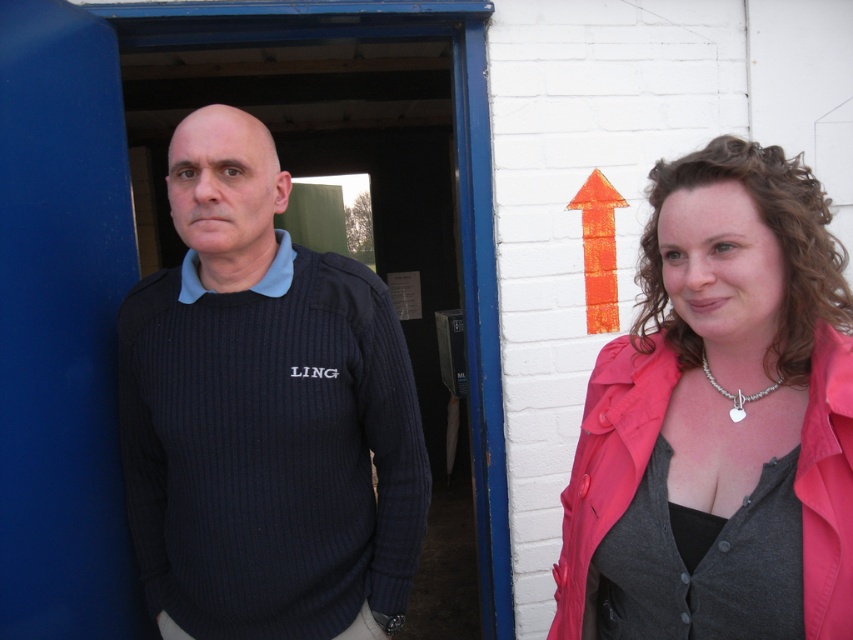
You are trying to decide which sweater to wear for a casual day out. Both the knitted dark blue sweater at left and the dark blue ribbed sweater at center are options. Based on their sizes, which one would be better if you prefer a more fitted look?

The knitted dark blue sweater at left is narrower than the dark blue ribbed sweater at center, so it would be better for a more fitted look since it has a slimmer width.

You are a fashion designer analyzing the image. You need to determine the spatial relationship between the dark blue ribbed sweater at center and the orange textured arrow at upper center. Which object is positioned higher in the image?

The orange textured arrow at upper center is positioned higher than the dark blue ribbed sweater at center.